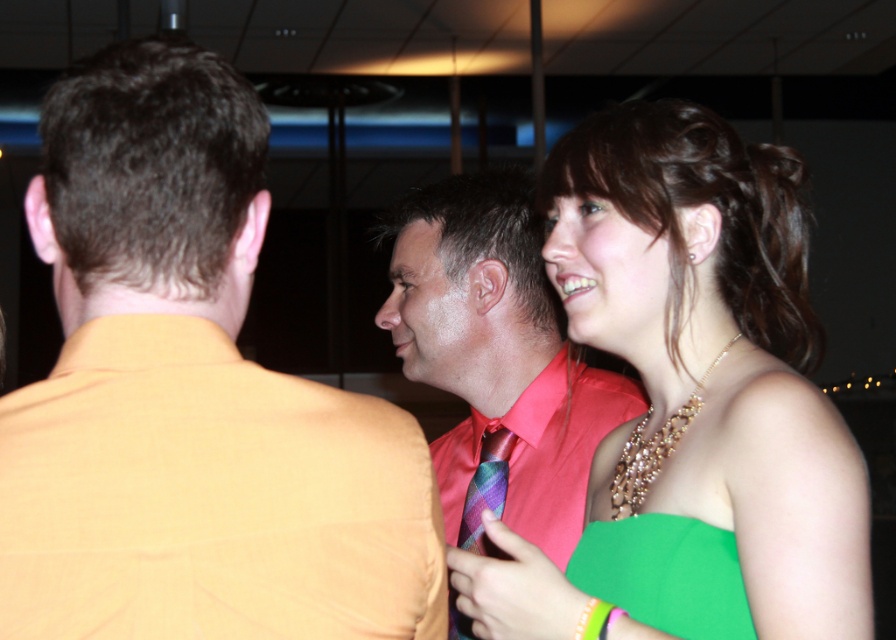
Question: Which of the following is the closest to the observer?

Choices:
 (A) (481, 294)
 (B) (657, 518)

Answer: (B)

Question: Among these points, which one is nearest to the camera?

Choices:
 (A) (705, 625)
 (B) (642, 161)
 (C) (464, 500)
 (D) (169, 88)

Answer: (D)

Question: Is orange fabric shirt at left smaller than green satin dress at center?

Choices:
 (A) no
 (B) yes

Answer: (B)

Question: Can you confirm if orange fabric shirt at left is positioned to the right of green satin dress at center?

Choices:
 (A) no
 (B) yes

Answer: (A)

Question: Which of the following is the farthest from the observer?

Choices:
 (A) orange fabric shirt at left
 (B) green satin dress at center

Answer: (B)

Question: Can you confirm if green satin dress at center is smaller than green fabric dress at center?

Choices:
 (A) yes
 (B) no

Answer: (B)